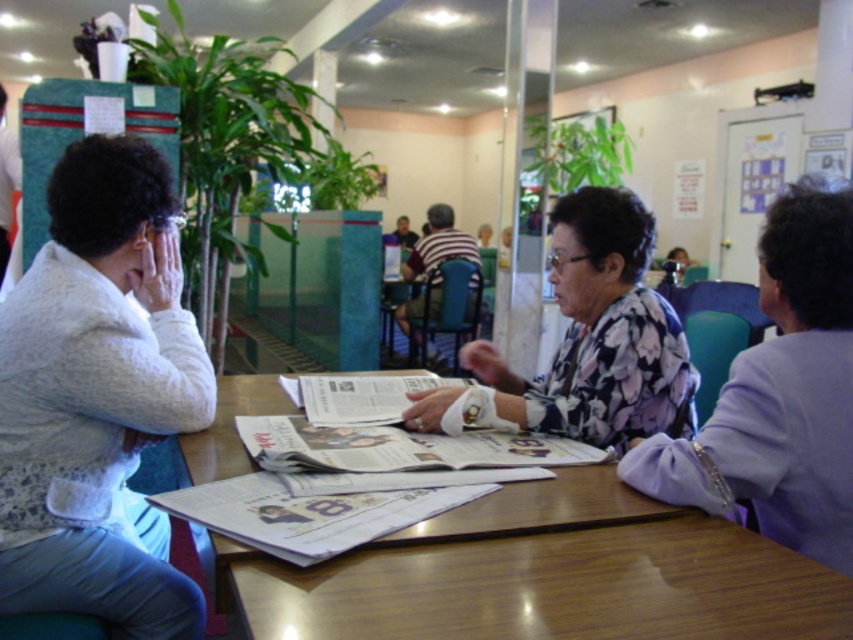
Can you confirm if floral fabric blouse at center is wider than smooth skin face at center?

Indeed, floral fabric blouse at center has a greater width compared to smooth skin face at center.

Which is in front, point (775, 252) or point (399, 237)?

Point (775, 252) is in front.

You are a GUI agent. You are given a task and a screenshot of the screen. Output one action in this format:
    pyautogui.click(x=<x>, y=<y>)
    Task: Click on the floral fabric blouse at center
    Image resolution: width=853 pixels, height=640 pixels.
    Given the screenshot: What is the action you would take?
    pyautogui.click(x=780, y=394)

Locate an element on the screen. This screenshot has height=640, width=853. striped cotton shirt at center is located at coordinates (432, 266).

Is striped cotton shirt at center to the left of matte black jacket at left from the viewer's perspective?

No, striped cotton shirt at center is not to the left of matte black jacket at left.

The image size is (853, 640). What do you see at coordinates (432, 266) in the screenshot?
I see `striped cotton shirt at center` at bounding box center [432, 266].

In order to click on striped cotton shirt at center in this screenshot , I will do `click(432, 266)`.

Where is `floral fabric blouse at center`? This screenshot has height=640, width=853. floral fabric blouse at center is located at coordinates (780, 394).

Does floral fabric blouse at center have a greater width compared to striped cotton shirt at center?

No, floral fabric blouse at center is not wider than striped cotton shirt at center.

What do you see at coordinates (780, 394) in the screenshot? The height and width of the screenshot is (640, 853). I see `floral fabric blouse at center` at bounding box center [780, 394].

The width and height of the screenshot is (853, 640). In order to click on floral fabric blouse at center in this screenshot , I will do `click(780, 394)`.